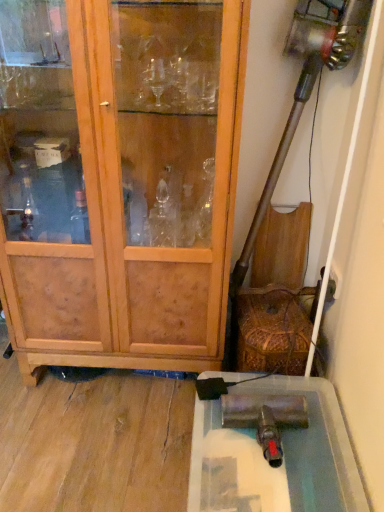
Question: Looking at the image, does wooden cabinet at left seem bigger or smaller compared to metallic silver cabinet at lower right?

Choices:
 (A) small
 (B) big

Answer: (B)

Question: In terms of height, does wooden cabinet at left look taller or shorter compared to metallic silver cabinet at lower right?

Choices:
 (A) tall
 (B) short

Answer: (A)

Question: Is wooden cabinet at left situated inside metallic silver cabinet at lower right or outside?

Choices:
 (A) outside
 (B) inside

Answer: (A)

Question: Do you think metallic silver cabinet at lower right is within wooden cabinet at left, or outside of it?

Choices:
 (A) inside
 (B) outside

Answer: (B)

Question: From the image's perspective, is metallic silver cabinet at lower right located above or below wooden cabinet at left?

Choices:
 (A) below
 (B) above

Answer: (A)

Question: Is point (264, 490) positioned closer to the camera than point (175, 157)?

Choices:
 (A) farther
 (B) closer

Answer: (B)

Question: Considering the positions of metallic silver cabinet at lower right and wooden cabinet at left in the image, is metallic silver cabinet at lower right bigger or smaller than wooden cabinet at left?

Choices:
 (A) small
 (B) big

Answer: (A)